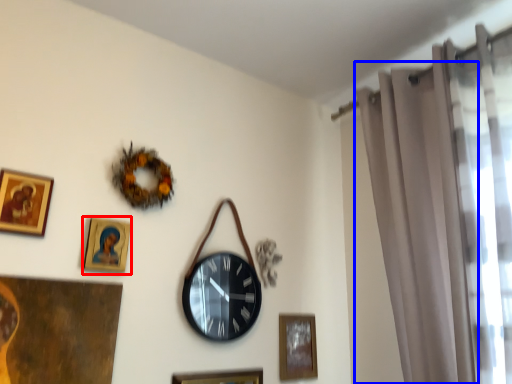
Question: Among these objects, which one is farthest to the camera, picture frame (highlighted by a red box) or curtain (highlighted by a blue box)?

Choices:
 (A) picture frame
 (B) curtain

Answer: (A)